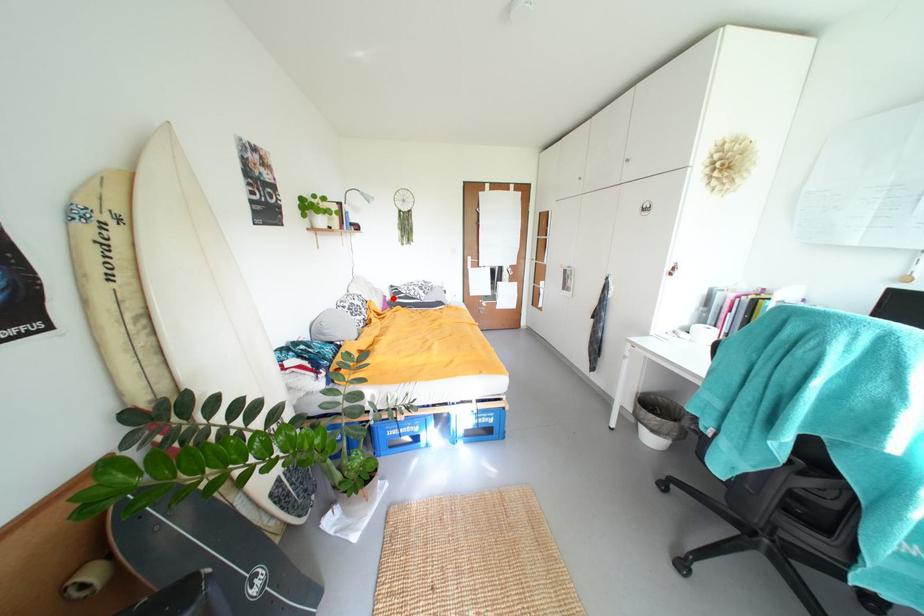
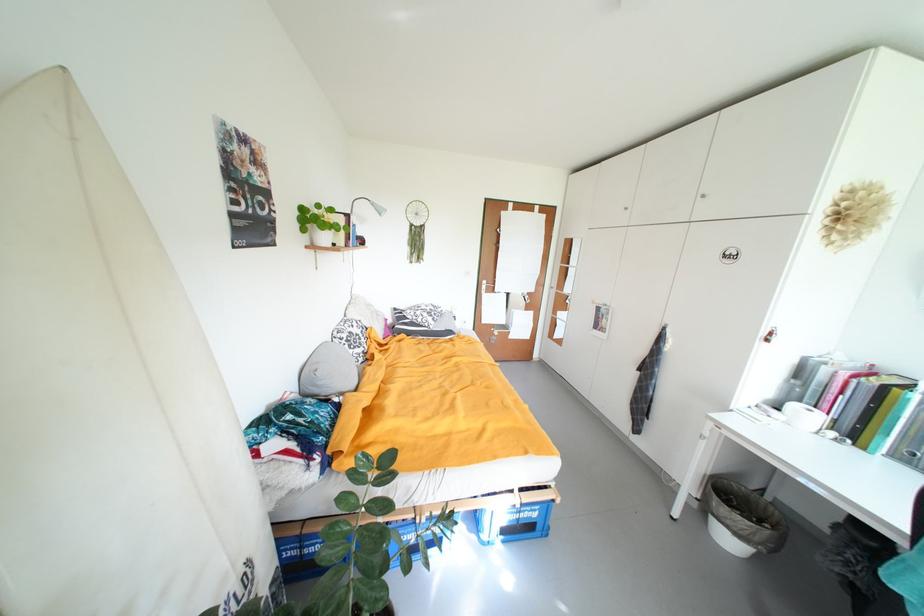
Question: I am providing you with two images of the same scene from different viewpoints. In image1, a red point is highlighted. Considering the same 3D point in image2, which of the following is correct?

Choices:
 (A) It is closer
 (B) It is farther

Answer: (B)